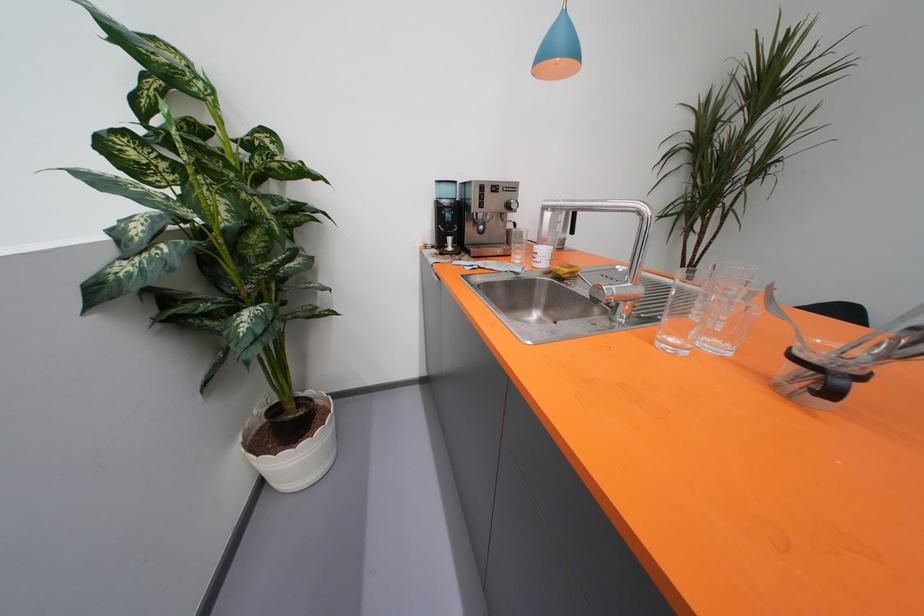
The height and width of the screenshot is (616, 924). I want to click on chrome faucet handle, so click(x=586, y=280).